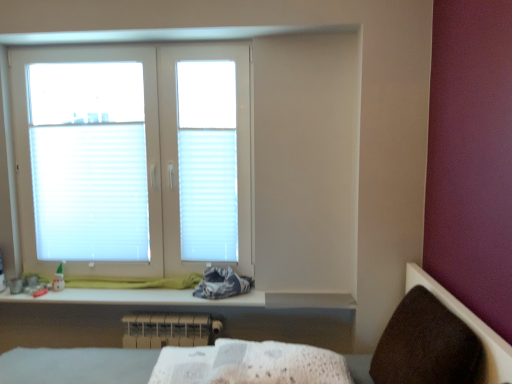
The width and height of the screenshot is (512, 384). In order to click on free spot above white pleated blind at upper left, acting as the 1th blind starting from the left (from a real-world perspective) in this screenshot , I will do `click(87, 125)`.